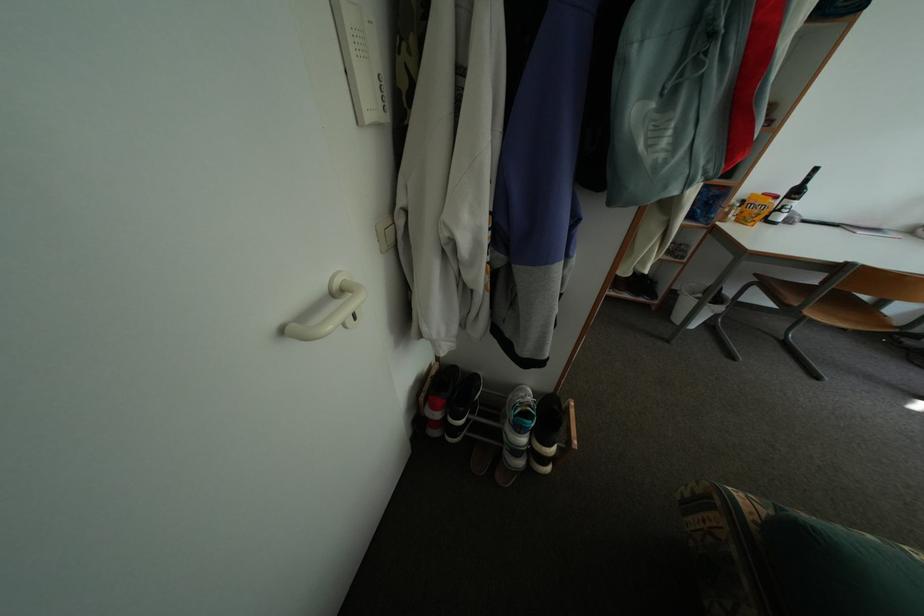
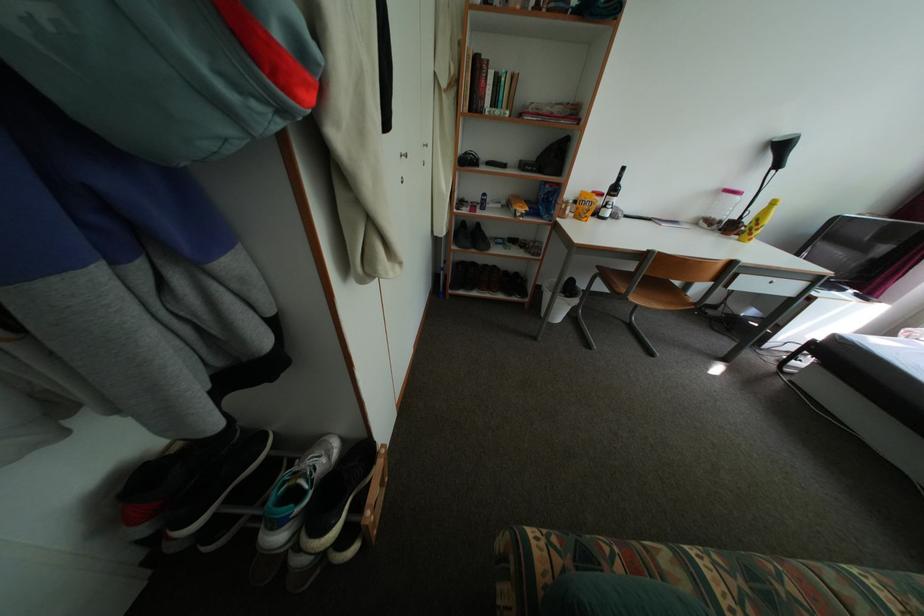
Question: The images are taken continuously from a first-person perspective. In which direction is your viewpoint rotating?

Choices:
 (A) Left
 (B) Right
 (C) Up
 (D) Down

Answer: (B)